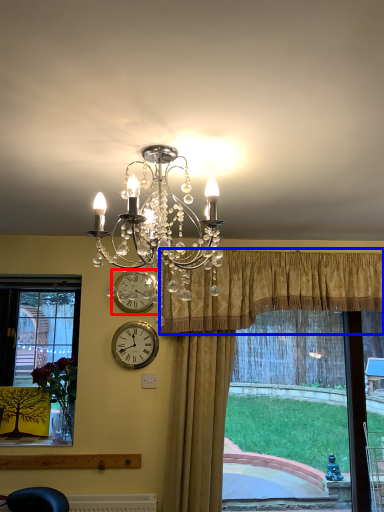
Question: Which of the following is the closest to the observer, clock (highlighted by a red box) or curtain (highlighted by a blue box)?

Choices:
 (A) clock
 (B) curtain

Answer: (B)